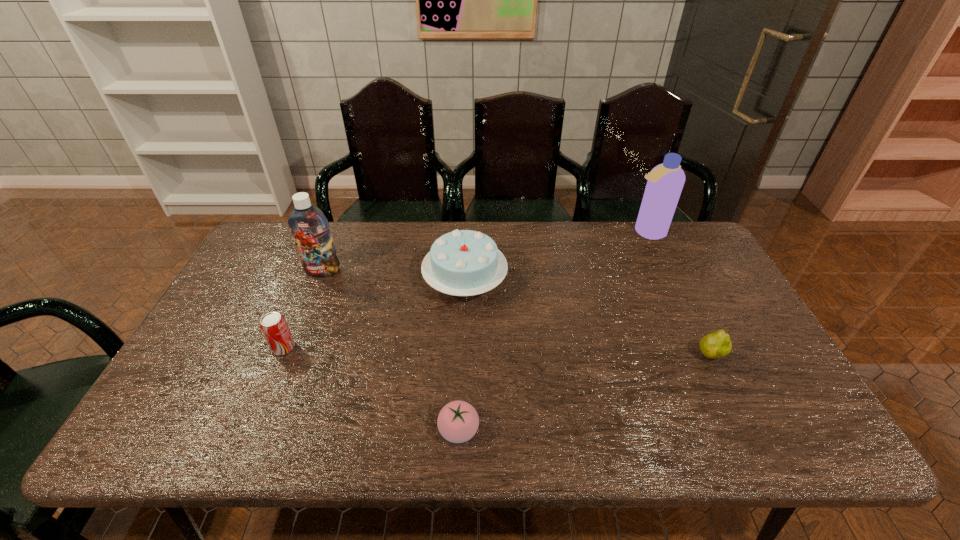
You are a GUI agent. You are given a task and a screenshot of the screen. Output one action in this format:
    pyautogui.click(x=<x>, y=<y>)
    Task: Click on the tallest detergent
    Image resolution: width=960 pixels, height=540 pixels.
    Given the screenshot: What is the action you would take?
    pyautogui.click(x=419, y=188)

What are the coordinates of `the tallest object` in the screenshot? It's located at (419, 188).

Find the location of a particular element. the biggest white detergent is located at coordinates (715, 243).

You are a GUI agent. You are given a task and a screenshot of the screen. Output one action in this format:
    pyautogui.click(x=<x>, y=<y>)
    Task: Click on the third detergent from right to left
    This screenshot has height=540, width=960.
    Given the screenshot: What is the action you would take?
    click(549, 204)

Where is `the second biggest red detergent`? The width and height of the screenshot is (960, 540). the second biggest red detergent is located at coordinates pos(549,204).

Where is `the leftmost white detergent`? the leftmost white detergent is located at coordinates (234, 248).

You are a GUI agent. You are given a task and a screenshot of the screen. Output one action in this format:
    pyautogui.click(x=<x>, y=<y>)
    Task: Click on the third farthest red detergent
    Image resolution: width=960 pixels, height=540 pixels.
    Given the screenshot: What is the action you would take?
    pyautogui.click(x=492, y=298)

I want to click on the second red detergent from right to left, so click(492, 298).

Locate an element on the screen. The width and height of the screenshot is (960, 540). pumpkin is located at coordinates (351, 326).

Identify the location of the nearest white detergent. pyautogui.click(x=786, y=342).